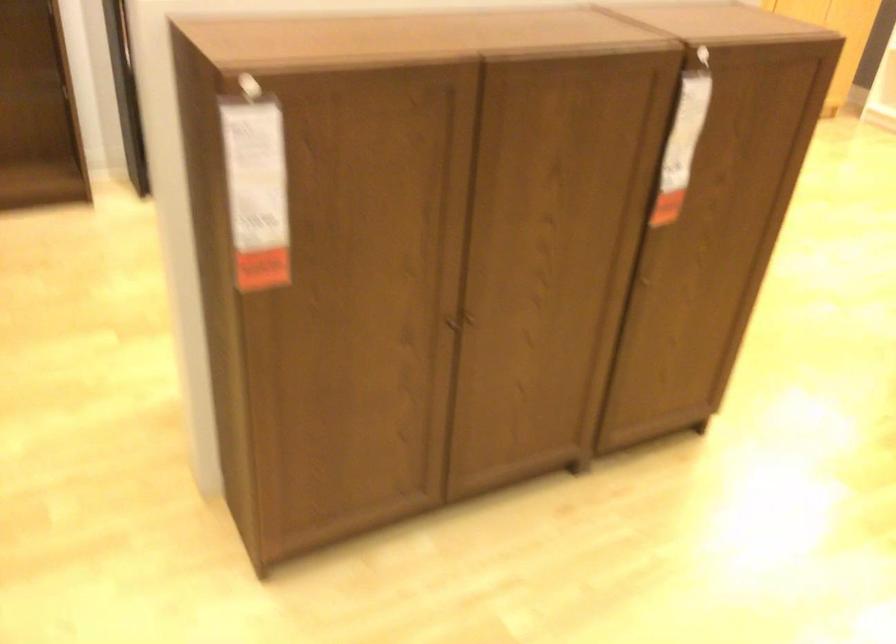
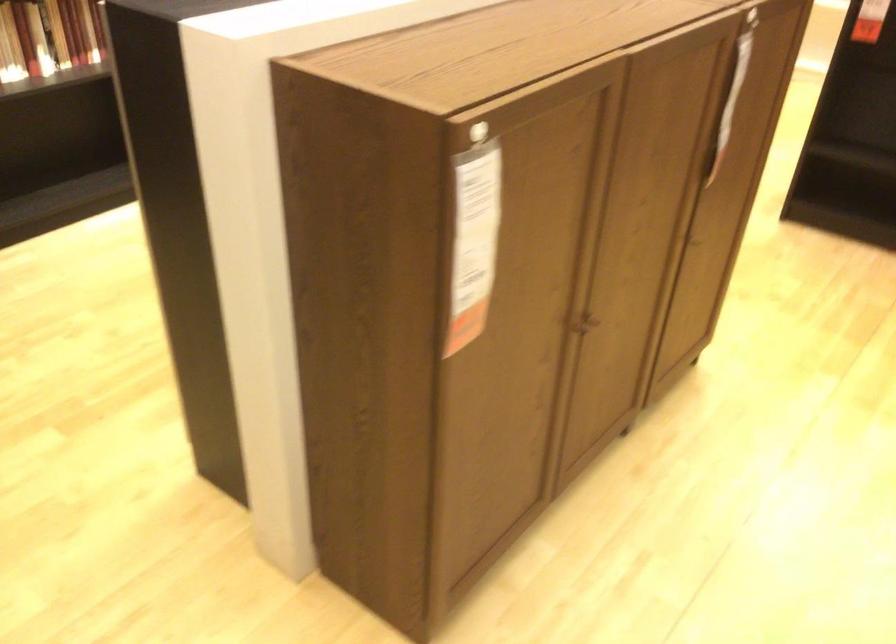
Question: How did the camera likely rotate?

Choices:
 (A) Left
 (B) Right
 (C) Up
 (D) Down

Answer: (B)